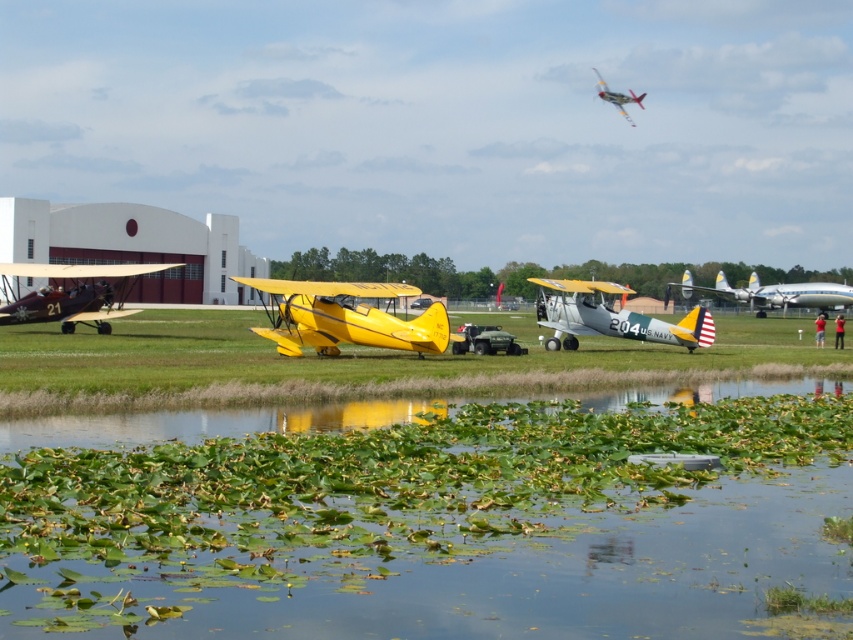
Question: Which of the following is the farthest from the observer?

Choices:
 (A) silver metallic airplane at center
 (B) polished chrome airplane at upper center

Answer: (B)

Question: Is green leafy water at lower center to the left of yellow matte airplane at center from the viewer's perspective?

Choices:
 (A) yes
 (B) no

Answer: (B)

Question: Does silver metallic airplane at center have a lesser width compared to silver metallic airplane at center right?

Choices:
 (A) no
 (B) yes

Answer: (B)

Question: Which object appears farthest from the camera in this image?

Choices:
 (A) matte yellow biplane at left
 (B) silver metallic airplane at center right
 (C) silver metallic airplane at center

Answer: (B)

Question: Does yellow matte airplane at center appear on the left side of silver metallic airplane at center?

Choices:
 (A) no
 (B) yes

Answer: (B)

Question: Which point is farther to the camera?

Choices:
 (A) yellow matte airplane at center
 (B) silver metallic airplane at center right
 (C) polished chrome airplane at upper center

Answer: (C)